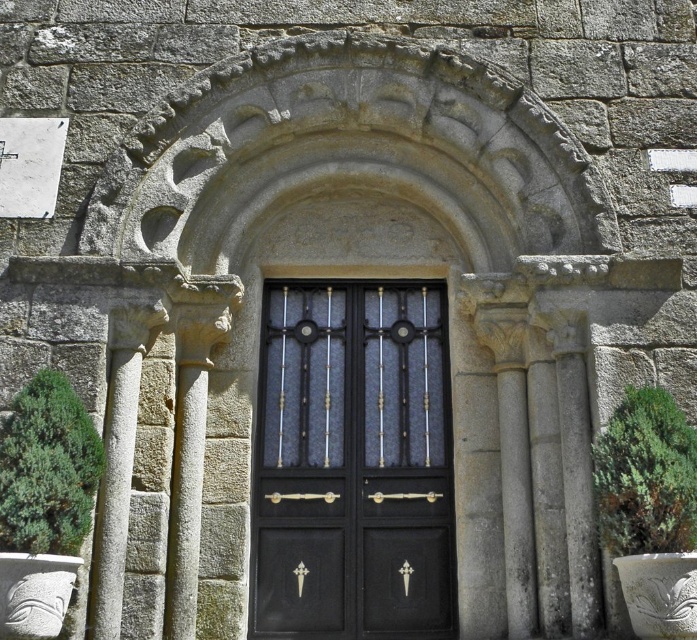
Between green leafy bush at left and green leafy plant at right, which one is positioned higher?

green leafy plant at right

Consider the image. Is green leafy bush at left thinner than green leafy plant at right?

Yes, green leafy bush at left is thinner than green leafy plant at right.

Is point (61, 532) positioned after point (668, 412)?

That is False.

Locate an element on the screen. The height and width of the screenshot is (640, 697). green leafy bush at left is located at coordinates (47, 468).